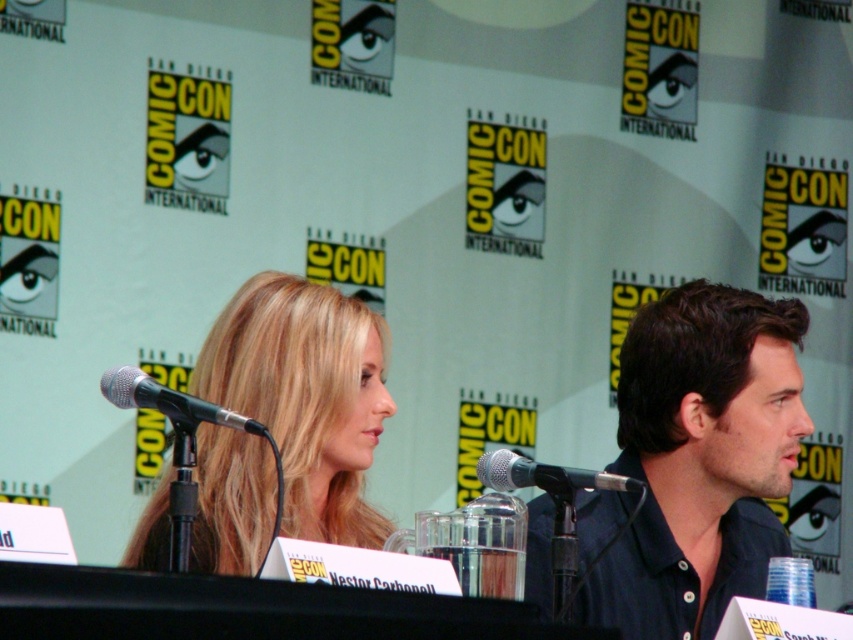
Looking at this image, which is more to the right, blonde hair at center or silver metallic microphone at left?

From the viewer's perspective, blonde hair at center appears more on the right side.

Can you confirm if blonde hair at center is smaller than silver metallic microphone at left?

Actually, blonde hair at center might be larger than silver metallic microphone at left.

Which is in front, point (247, 468) or point (109, 372)?

Point (109, 372) is more forward.

Where is `blonde hair at center`? This screenshot has width=853, height=640. blonde hair at center is located at coordinates (306, 396).

Is point (581, 497) positioned in front of point (325, 499)?

No, it is not.

Is point (624, 352) positioned behind point (282, 378)?

Yes, point (624, 352) is behind point (282, 378).

At what (x,y) coordinates should I click in order to perform the action: click on dark blue shirt at right. Please return your answer as a coordinate pair (x, y). The height and width of the screenshot is (640, 853). Looking at the image, I should click on pos(700,458).

Can you confirm if blonde hair at center is smaller than black metallic microphone at center?

No.

Is the position of blonde hair at center more distant than that of black metallic microphone at center?

No, blonde hair at center is in front of black metallic microphone at center.

Is point (250, 307) closer to viewer compared to point (547, 490)?

No, it is not.

This screenshot has width=853, height=640. In order to click on blonde hair at center in this screenshot , I will do `click(306, 396)`.